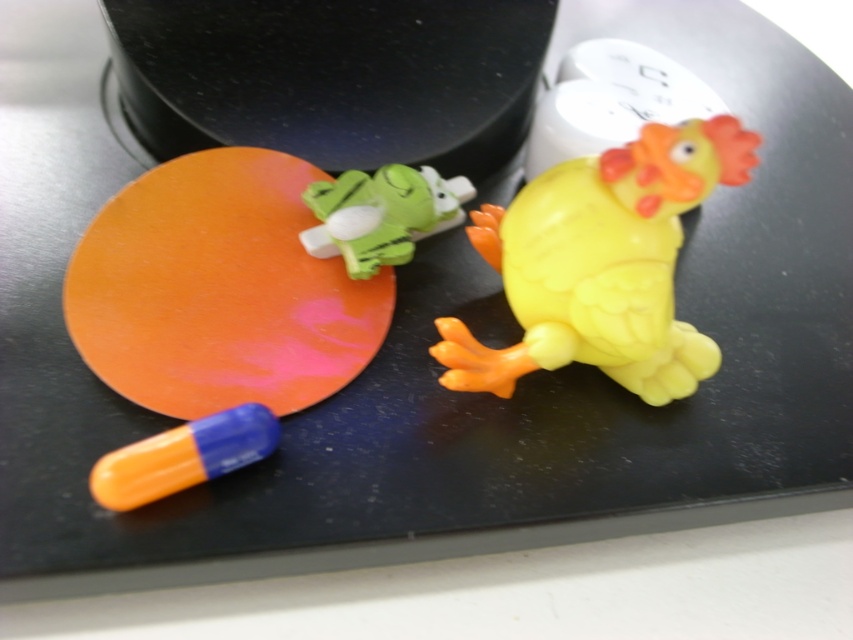
Question: Which object is positioned closest to the yellow rubber chicken at center?

Choices:
 (A) green rubber frog at center
 (B) orange matte pill at lower left

Answer: (A)

Question: Which is farther from the orange matte pill at lower left?

Choices:
 (A) green rubber frog at center
 (B) yellow rubber chicken at center

Answer: (B)

Question: Does yellow rubber chicken at center appear on the left side of green rubber frog at center?

Choices:
 (A) yes
 (B) no

Answer: (B)

Question: Does yellow rubber chicken at center have a smaller size compared to orange matte pill at lower left?

Choices:
 (A) yes
 (B) no

Answer: (B)

Question: Which point is closer to the camera?

Choices:
 (A) (463, 371)
 (B) (158, 467)
 (C) (383, 228)

Answer: (B)

Question: Can you confirm if yellow rubber chicken at center is positioned to the right of green rubber frog at center?

Choices:
 (A) no
 (B) yes

Answer: (B)